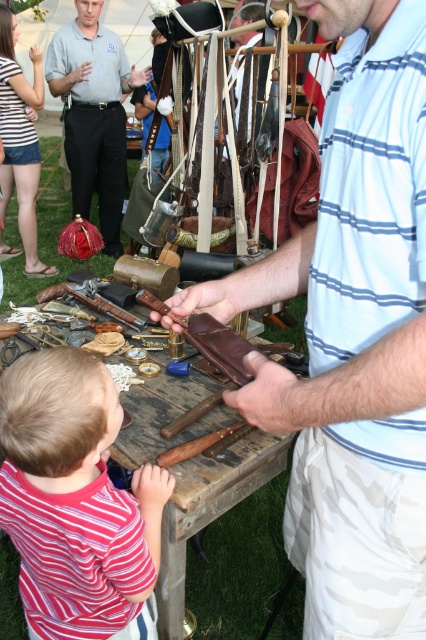
Does striped shirt at lower left have a lesser height compared to matte black shirt at upper left?

Correct, striped shirt at lower left is not as tall as matte black shirt at upper left.

Between striped shirt at lower left and matte black shirt at upper left, which one is positioned lower?

Positioned lower is striped shirt at lower left.

Which is behind, point (60, 436) or point (52, 76)?

Positioned behind is point (52, 76).

Find the location of a particular element. Image resolution: width=426 pixels, height=640 pixels. striped shirt at lower left is located at coordinates (74, 499).

Who is more forward, (72, 394) or (298, 307)?

Positioned in front is point (72, 394).

Can you confirm if striped shirt at lower left is positioned to the right of wooden table at center?

Incorrect, striped shirt at lower left is not on the right side of wooden table at center.

Find the location of a particular element. The image size is (426, 640). striped shirt at lower left is located at coordinates (74, 499).

Is wooden table at center below matte black shirt at upper left?

Correct, wooden table at center is located below matte black shirt at upper left.

Between wooden table at center and matte black shirt at upper left, which one has less height?

Standing shorter between the two is wooden table at center.

The width and height of the screenshot is (426, 640). What are the coordinates of `wooden table at center` in the screenshot? It's located at (238, 566).

Where is `wooden table at center`? This screenshot has width=426, height=640. wooden table at center is located at coordinates (238, 566).